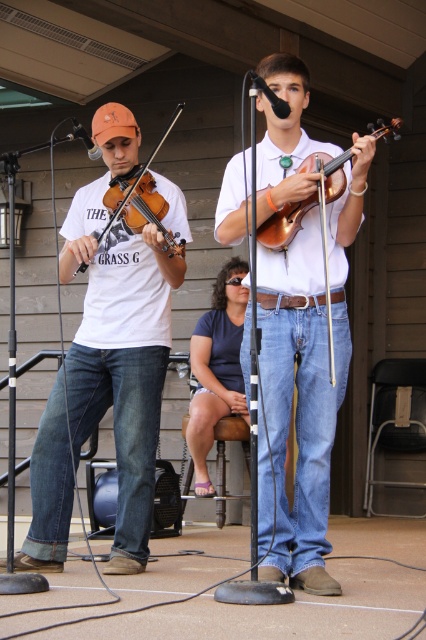
Question: Is wooden violin at center bigger than matte brown violin at left?

Choices:
 (A) no
 (B) yes

Answer: (A)

Question: Which object is positioned farthest from the matte brown violin at left?

Choices:
 (A) matte brown violin at center
 (B) matte white t-shirt at left
 (C) wooden violin at center

Answer: (A)

Question: Does matte brown violin at center appear on the left side of matte brown violin at left?

Choices:
 (A) no
 (B) yes

Answer: (A)

Question: Among these points, which one is nearest to the camera?

Choices:
 (A) pos(118,397)
 (B) pos(135,182)
 (C) pos(325,365)

Answer: (C)

Question: Among these objects, which one is farthest from the camera?

Choices:
 (A) matte white t-shirt at left
 (B) matte brown violin at center

Answer: (A)

Question: Observing the image, what is the correct spatial positioning of matte white t-shirt at left in reference to matte brown violin at center?

Choices:
 (A) left
 (B) right

Answer: (A)